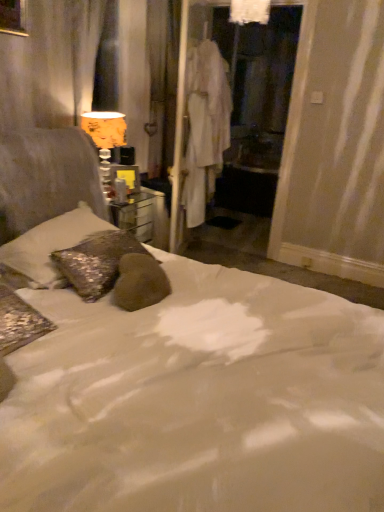
Question: Relative to orange fabric lampshade at upper left, is white fabric screen door at center in front or behind?

Choices:
 (A) behind
 (B) front

Answer: (A)

Question: Is white fabric screen door at center inside the boundaries of orange fabric lampshade at upper left, or outside?

Choices:
 (A) outside
 (B) inside

Answer: (A)

Question: Estimate the real-world distances between objects in this image. Which object is farther from the white fabric robe at center?

Choices:
 (A) white fabric screen door at center
 (B) sparkly silver pillow at left
 (C) orange fabric lampshade at upper left

Answer: (B)

Question: Estimate the real-world distances between objects in this image. Which object is closer to the sparkly silver pillow at left?

Choices:
 (A) orange fabric lampshade at upper left
 (B) white fabric screen door at center
 (C) white fabric robe at center

Answer: (A)